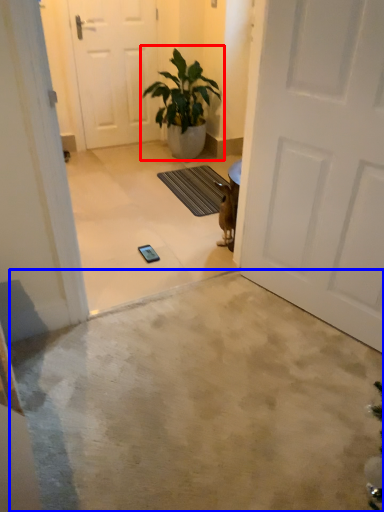
Question: Among these objects, which one is nearest to the camera, houseplant (highlighted by a red box) or concrete (highlighted by a blue box)?

Choices:
 (A) houseplant
 (B) concrete

Answer: (B)